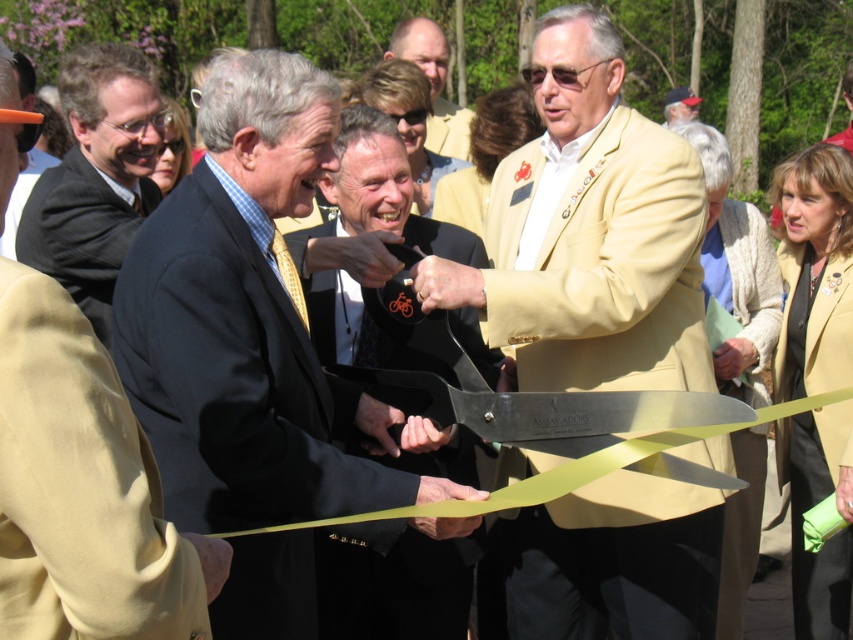
Question: Among these objects, which one is farthest from the camera?

Choices:
 (A) light brown leather jacket at upper center
 (B) matte black suit at center
 (C) black plastic scissors at center
 (D) dark gray suit at left

Answer: (A)

Question: Is matte black suit at left positioned before black plastic scissors at center?

Choices:
 (A) no
 (B) yes

Answer: (B)

Question: In this image, where is matte gold suit at center located relative to matte black suit at left?

Choices:
 (A) right
 (B) left

Answer: (A)

Question: Which of these objects is positioned closest to the matte black suit at center?

Choices:
 (A) matte yellow jacket at center
 (B) matte gold suit at center
 (C) matte black suit at left
 (D) light brown leather jacket at upper center

Answer: (B)

Question: Which object is farther from the camera taking this photo?

Choices:
 (A) matte black suit at center
 (B) matte gold suit at center
 (C) light brown leather jacket at upper center

Answer: (C)

Question: Can you confirm if matte yellow jacket at center is positioned to the left of light brown leather jacket at upper center?

Choices:
 (A) no
 (B) yes

Answer: (B)